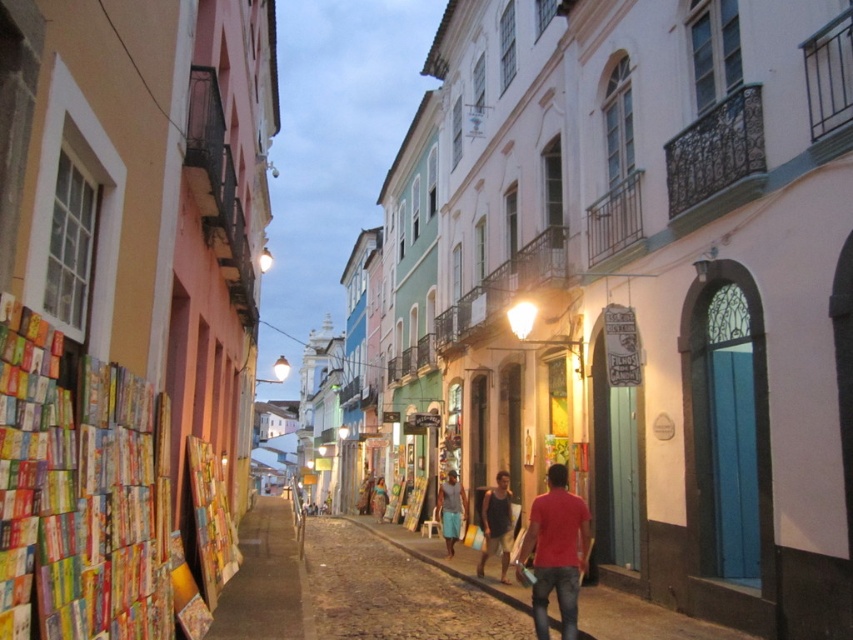
Question: Which is nearer to the matte red t-shirt at center?

Choices:
 (A) matte gray tank top at center
 (B) gray fabric shorts at center
 (C) matte gray t-shirt at center

Answer: (A)

Question: Which object is positioned farthest from the matte red t-shirt at center?

Choices:
 (A) matte gray tank top at center
 (B) gray fabric shorts at center
 (C) matte gray t-shirt at center

Answer: (C)

Question: Which point appears closest to the camera in this image?

Choices:
 (A) (554, 512)
 (B) (498, 544)
 (C) (460, 525)

Answer: (A)

Question: Is gray fabric shorts at center in front of matte gray t-shirt at center?

Choices:
 (A) no
 (B) yes

Answer: (B)

Question: Is matte red t-shirt at center to the left of gray fabric shorts at center from the viewer's perspective?

Choices:
 (A) no
 (B) yes

Answer: (A)

Question: Where is matte red t-shirt at center located in relation to matte gray t-shirt at center in the image?

Choices:
 (A) right
 (B) left

Answer: (A)